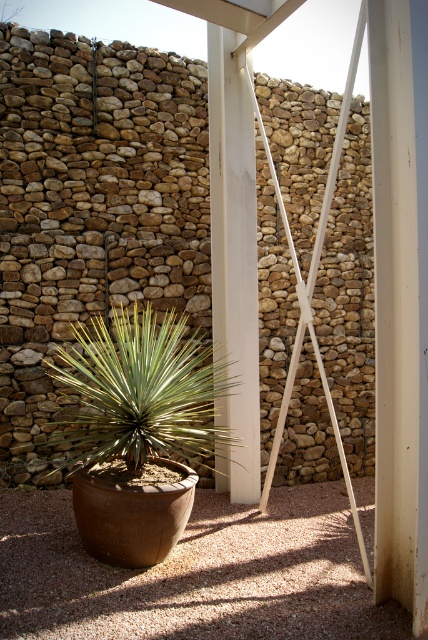
You are standing in the outdoor scene and want to walk from the point at coordinates point (139, 282) to the point at coordinates point (107, 429). Which direction should you face to move towards your destination?

Since point (139, 282) is behind point (107, 429), you should face forward to move towards the destination.

You are standing in front of the stone wall and want to place a small birdhouse between the brown textured stone at center and the green leafy plant at center. Based on their positions, where should you place the birdhouse?

The brown textured stone at center is located above the green leafy plant at center, so you should place the birdhouse between them by positioning it below the brown textured stone at center and above the green leafy plant at center.